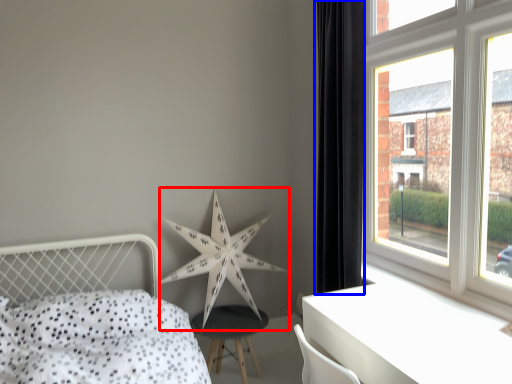
Question: Which object is closer to the camera taking this photo, star (highlighted by a red box) or curtain (highlighted by a blue box)?

Choices:
 (A) star
 (B) curtain

Answer: (B)